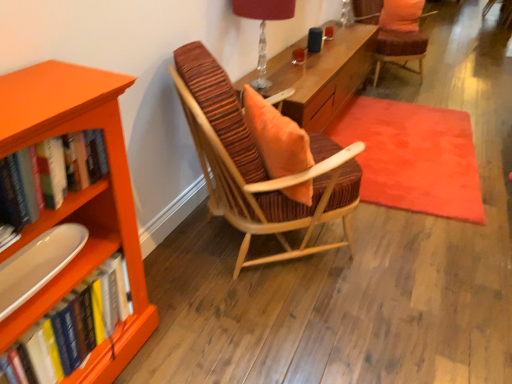
Question: Can you confirm if matte white tray at lower left is bigger than translucent glass table lamp at upper center?

Choices:
 (A) no
 (B) yes

Answer: (A)

Question: Can you confirm if matte white tray at lower left is taller than translucent glass table lamp at upper center?

Choices:
 (A) yes
 (B) no

Answer: (B)

Question: Are matte white tray at lower left and translucent glass table lamp at upper center making contact?

Choices:
 (A) yes
 (B) no

Answer: (B)

Question: From a real-world perspective, does matte white tray at lower left stand above translucent glass table lamp at upper center?

Choices:
 (A) yes
 (B) no

Answer: (B)

Question: Does matte white tray at lower left come in front of translucent glass table lamp at upper center?

Choices:
 (A) yes
 (B) no

Answer: (A)

Question: Is striped fabric chair at center, which appears as the 2th chair when viewed from the top, in front of or behind translucent glass table lamp at upper center in the image?

Choices:
 (A) behind
 (B) front

Answer: (B)

Question: From the image's perspective, relative to translucent glass table lamp at upper center, is striped fabric chair at center, the first chair from the left, above or below?

Choices:
 (A) above
 (B) below

Answer: (B)

Question: Is striped fabric chair at center, the 1th chair in the front-to-back sequence, wider or thinner than translucent glass table lamp at upper center?

Choices:
 (A) wide
 (B) thin

Answer: (A)

Question: Is striped fabric chair at center, which appears as the 2th chair when viewed from the top, inside or outside of translucent glass table lamp at upper center?

Choices:
 (A) outside
 (B) inside

Answer: (A)

Question: Is striped fabric chair at center, the 1th chair positioned from the bottom, wider or thinner than hardcover books at left, which ranks as the 2th book in top-to-bottom order?

Choices:
 (A) thin
 (B) wide

Answer: (B)

Question: In terms of size, does striped fabric chair at center, which is the second chair in right-to-left order, appear bigger or smaller than hardcover books at left, acting as the 1th book starting from the bottom?

Choices:
 (A) big
 (B) small

Answer: (A)

Question: Would you say striped fabric chair at center, which is the second chair in right-to-left order, is to the left or to the right of hardcover books at left, acting as the 1th book starting from the bottom, in the picture?

Choices:
 (A) left
 (B) right

Answer: (B)

Question: Considering the positions of point (224, 196) and point (77, 357), is point (224, 196) closer or farther from the camera than point (77, 357)?

Choices:
 (A) farther
 (B) closer

Answer: (A)

Question: Considering the positions of hardcover books at left, positioned as the 1th book in top-to-bottom order, and translucent glass table lamp at upper center in the image, is hardcover books at left, positioned as the 1th book in top-to-bottom order, wider or thinner than translucent glass table lamp at upper center?

Choices:
 (A) thin
 (B) wide

Answer: (A)

Question: From the image's perspective, relative to translucent glass table lamp at upper center, is hardcover books at left, the second book in the bottom-to-top sequence, above or below?

Choices:
 (A) above
 (B) below

Answer: (B)